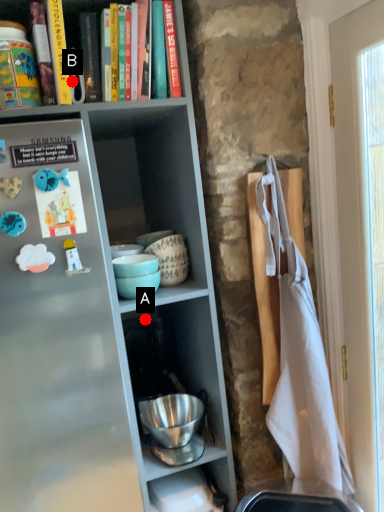
Question: Two points are circled on the image, labeled by A and B beside each circle. Which point is further to the camera?

Choices:
 (A) A is further
 (B) B is further

Answer: (A)